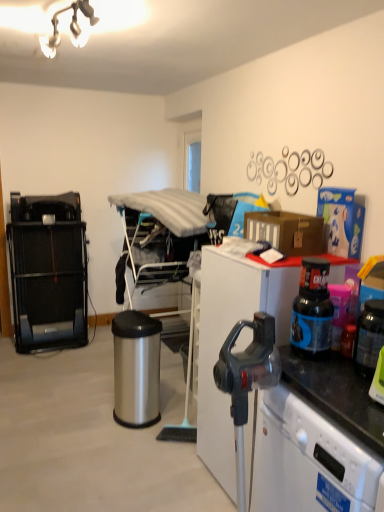
The width and height of the screenshot is (384, 512). Find the location of `free space to the left of translucent plastic bottle at right`. free space to the left of translucent plastic bottle at right is located at coordinates (325, 378).